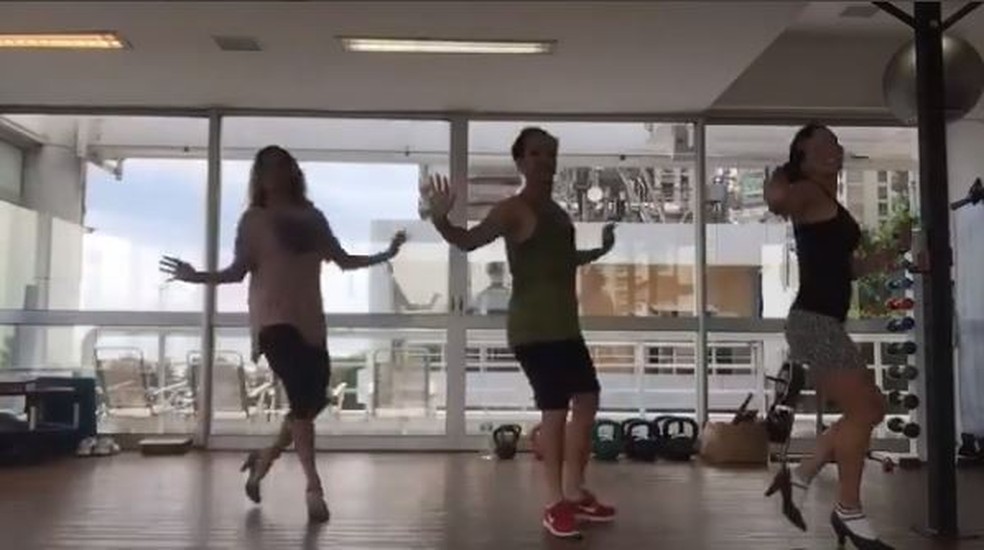
In order to click on sock in this screenshot , I will do `click(798, 494)`, `click(859, 524)`.